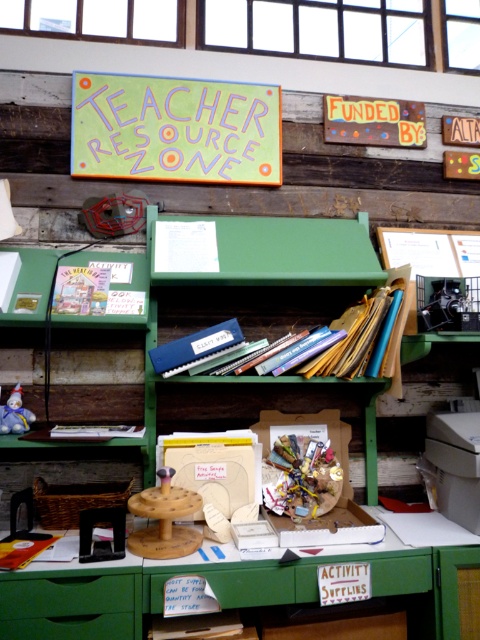
Question: Is green wood table at lower center above wooden stool at center?

Choices:
 (A) no
 (B) yes

Answer: (A)

Question: Which point is closer to the camera taking this photo?

Choices:
 (A) (0, 426)
 (B) (132, 547)
 (C) (130, 435)
 (D) (56, 276)

Answer: (B)

Question: Can you confirm if matte paper book at center is positioned to the right of matte white book at center?

Choices:
 (A) yes
 (B) no

Answer: (B)

Question: Which of the following is the closest to the observer?

Choices:
 (A) wooden stool at center
 (B) matte white book at center
 (C) green matte drawer at lower center
 (D) matte paper book at center

Answer: (C)

Question: Is wooden stool at center above white plush toy at lower left?

Choices:
 (A) yes
 (B) no

Answer: (B)

Question: Which point appears farthest from the camera in this image?

Choices:
 (A) (33, 627)
 (B) (171, 506)
 (C) (67, 435)

Answer: (C)